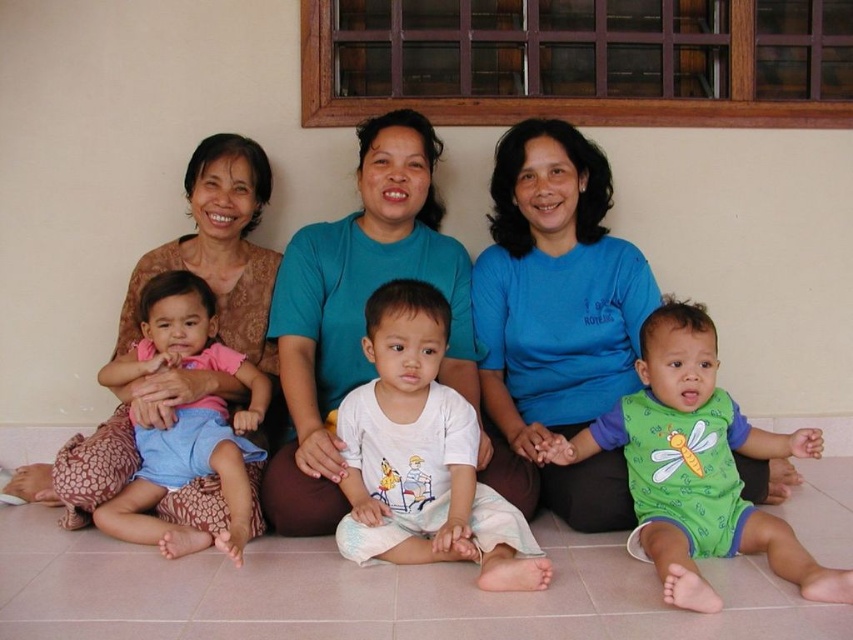
Which is below, green cotton onesie at lower right or matte brown lace dress at left?

Positioned lower is green cotton onesie at lower right.

Can you confirm if green cotton onesie at lower right is bigger than matte brown lace dress at left?

No.

The image size is (853, 640). What do you see at coordinates (697, 465) in the screenshot?
I see `green cotton onesie at lower right` at bounding box center [697, 465].

Locate an element on the screen. Image resolution: width=853 pixels, height=640 pixels. green cotton onesie at lower right is located at coordinates (697, 465).

Can you confirm if white cotton shirt at center is smaller than pink fabric shirt at left?

Yes.

Between white cotton shirt at center and pink fabric shirt at left, which one appears on the left side from the viewer's perspective?

From the viewer's perspective, pink fabric shirt at left appears more on the left side.

Locate an element on the screen. The width and height of the screenshot is (853, 640). white cotton shirt at center is located at coordinates (422, 456).

Image resolution: width=853 pixels, height=640 pixels. What are the coordinates of `white cotton shirt at center` in the screenshot? It's located at (422, 456).

Can you confirm if green cotton onesie at lower right is smaller than pink fabric shirt at left?

No.

In the scene shown: Can you confirm if green cotton onesie at lower right is positioned to the left of pink fabric shirt at left?

No, green cotton onesie at lower right is not to the left of pink fabric shirt at left.

The height and width of the screenshot is (640, 853). I want to click on green cotton onesie at lower right, so click(x=697, y=465).

Find the location of a particular element. The height and width of the screenshot is (640, 853). green cotton onesie at lower right is located at coordinates (697, 465).